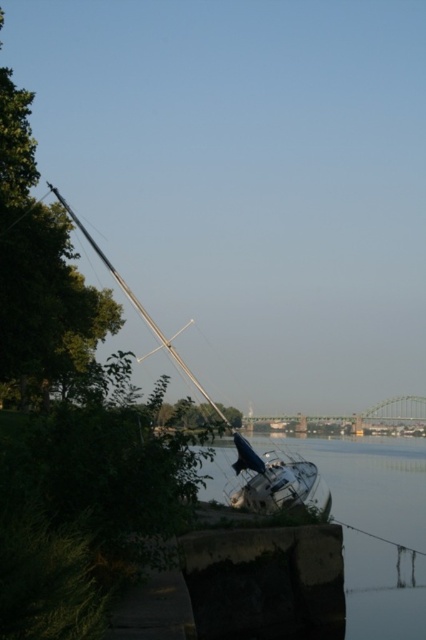
Question: Which of the following is the closest to the observer?

Choices:
 (A) white glossy boat at center
 (B) smooth concrete wall at lower center

Answer: (B)

Question: Estimate the real-world distances between objects in this image. Which object is closer to the metallic silver mast at left?

Choices:
 (A) smooth concrete wall at lower center
 (B) white glossy boat at center

Answer: (B)

Question: Does smooth concrete wall at lower center appear on the right side of metallic silver mast at left?

Choices:
 (A) yes
 (B) no

Answer: (A)

Question: Is white glossy boat at center bigger than metallic silver mast at left?

Choices:
 (A) yes
 (B) no

Answer: (B)

Question: Is smooth concrete wall at lower center to the right of white glossy boat at center from the viewer's perspective?

Choices:
 (A) yes
 (B) no

Answer: (A)

Question: Which of the following is the closest to the observer?

Choices:
 (A) white glossy boat at center
 (B) smooth concrete wall at lower center
 (C) metallic silver mast at left

Answer: (B)